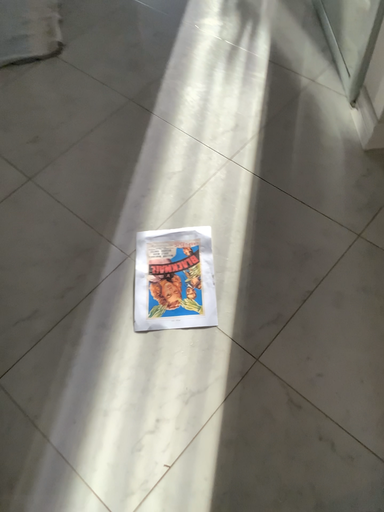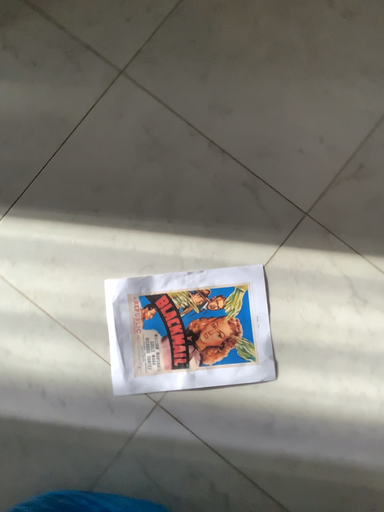
Question: How did the camera likely rotate when shooting the video?

Choices:
 (A) rotated downward
 (B) rotated upward

Answer: (B)